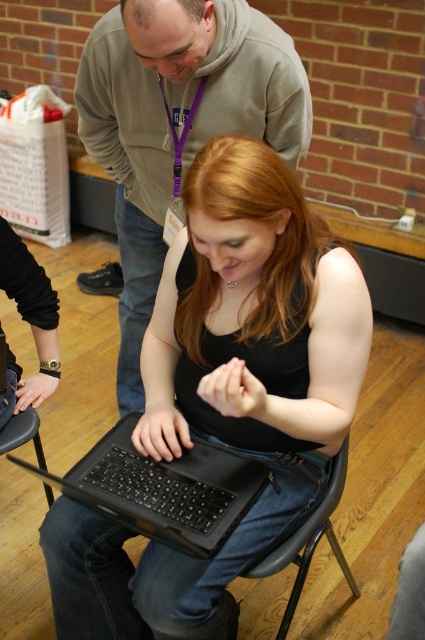
Consider the image. You are a delivery robot with a package that needs to be placed between the gray hoodie at upper center and the black plastic chair at lower left. The package is 24 inches long. Can you fit the package between them without moving either object?

The distance between the gray hoodie at upper center and the black plastic chair at lower left is 30.96 inches. Since the package is 24 inches long, it can fit between them as there is enough space.

You are a photographer taking a picture of the scene. The gray hoodie at upper center and the black matte laptop at center are both in the frame. Which object should you focus on first if you want to capture both in sharp detail?

The gray hoodie at upper center is taller than the black matte laptop at center, so focusing on the gray hoodie at upper center first would ensure both are in sharp detail since it is larger and might require more precise focus.